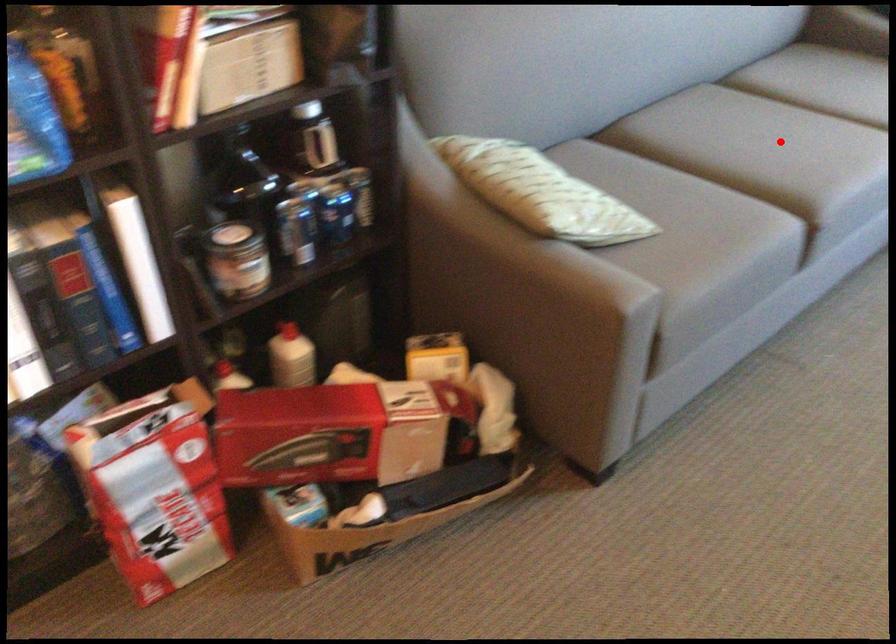
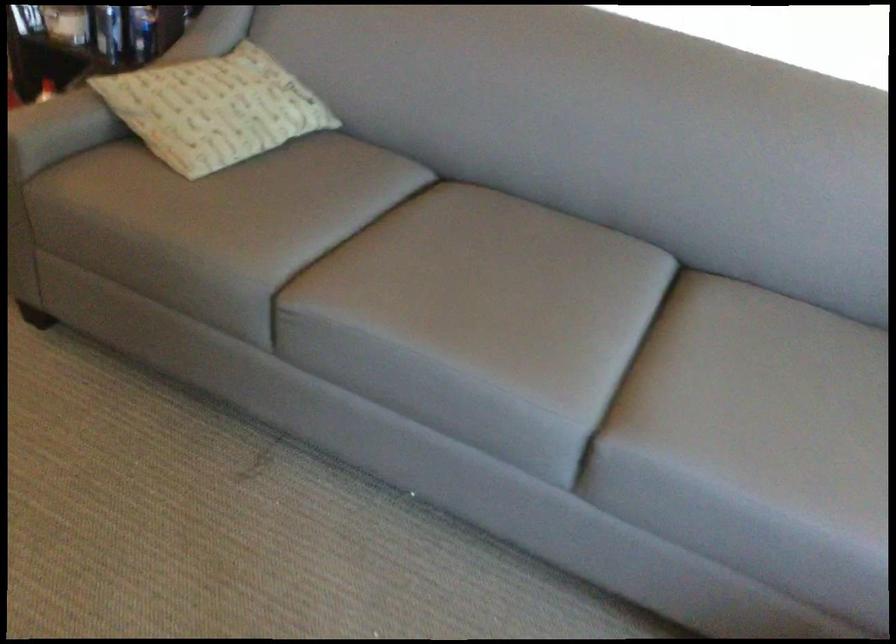
Question: I am providing you with two images of the same scene from different viewpoints. In image1, a red point is highlighted. Considering the same 3D point in image2, which of the following is correct?

Choices:
 (A) It is closer
 (B) It is farther

Answer: (A)